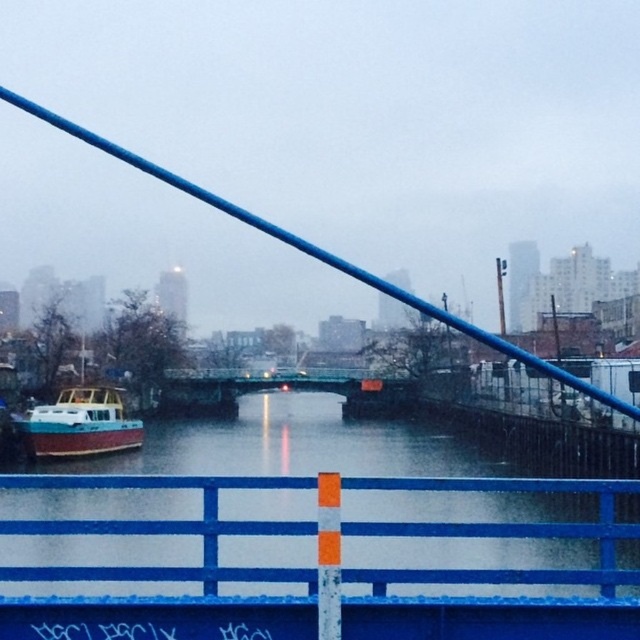
Question: Is smooth wooden boat at left below teal wooden boat at left?

Choices:
 (A) yes
 (B) no

Answer: (A)

Question: Which point is closer to the camera?

Choices:
 (A) blue painted metal rail at center
 (B) smooth wooden boat at left
 (C) teal wooden boat at left

Answer: (A)

Question: Does smooth wooden boat at left appear on the left side of blue painted metal rail at center?

Choices:
 (A) no
 (B) yes

Answer: (B)

Question: Which of the following is the closest to the observer?

Choices:
 (A) (326, 572)
 (B) (77, 536)

Answer: (A)

Question: Which object is farther from the camera taking this photo?

Choices:
 (A) teal wooden boat at left
 (B) smooth wooden boat at left
 (C) blue painted metal rail at center

Answer: (A)

Question: Is blue painted metal rail at center positioned behind teal wooden boat at left?

Choices:
 (A) yes
 (B) no

Answer: (B)